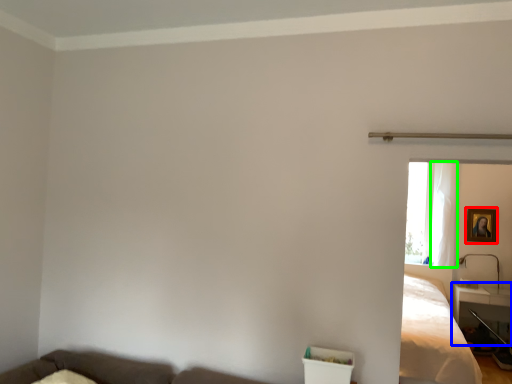
Question: Which is farther away from picture frame (highlighted by a red box)? table (highlighted by a blue box) or curtain (highlighted by a green box)?

Choices:
 (A) table
 (B) curtain

Answer: (A)